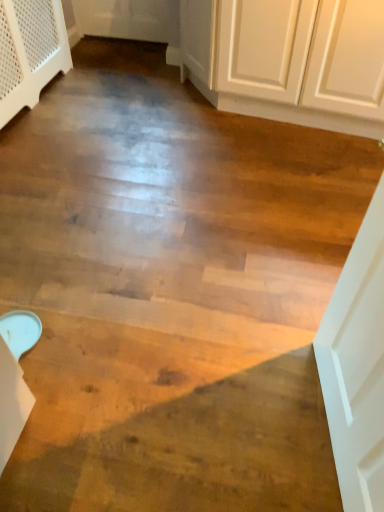
Question: From the image's perspective, is white textured dresser at upper left above or below white matte door at right?

Choices:
 (A) above
 (B) below

Answer: (A)

Question: From their relative heights in the image, would you say white textured dresser at upper left is taller or shorter than white matte door at right?

Choices:
 (A) tall
 (B) short

Answer: (B)

Question: From a real-world perspective, is white textured dresser at upper left physically located above or below white matte door at right?

Choices:
 (A) above
 (B) below

Answer: (B)

Question: Considering the positions of white matte door at right and white textured dresser at upper left in the image, is white matte door at right bigger or smaller than white textured dresser at upper left?

Choices:
 (A) big
 (B) small

Answer: (B)

Question: From a real-world perspective, relative to white textured dresser at upper left, is white matte door at right vertically above or below?

Choices:
 (A) above
 (B) below

Answer: (A)

Question: From the image's perspective, is white matte door at right above or below white textured dresser at upper left?

Choices:
 (A) above
 (B) below

Answer: (B)

Question: Is point (382, 198) closer or farther from the camera than point (13, 27)?

Choices:
 (A) farther
 (B) closer

Answer: (B)